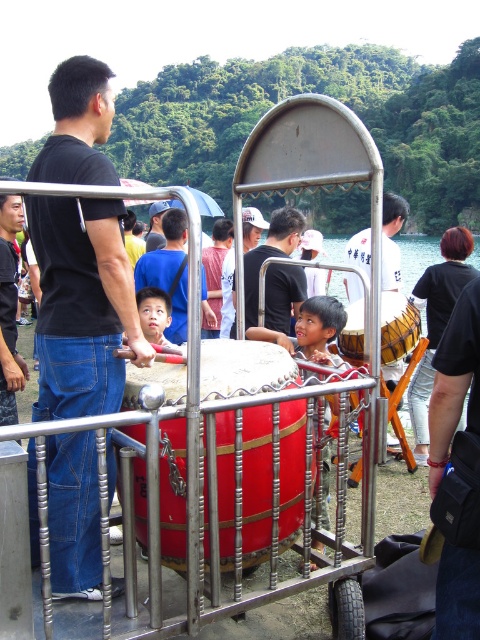
Question: Which point is farther to the camera?

Choices:
 (A) (162, 257)
 (B) (406, 202)

Answer: (B)

Question: Which object is the closest to the matte black shirt at center?

Choices:
 (A) black matte shirt at upper left
 (B) brushed metal drum at center

Answer: (B)

Question: Which is farther from the matte black shirt at center?

Choices:
 (A) brushed metal water at upper left
 (B) brushed metal drum at center

Answer: (A)

Question: Can you confirm if black matte shirt at upper left is positioned above brushed metal water at upper left?

Choices:
 (A) yes
 (B) no

Answer: (A)

Question: Is black matte shirt at upper left to the left of brushed metal drum at center from the viewer's perspective?

Choices:
 (A) no
 (B) yes

Answer: (B)

Question: Is brushed metal water at upper left positioned at the back of matte white shirt at center?

Choices:
 (A) yes
 (B) no

Answer: (A)